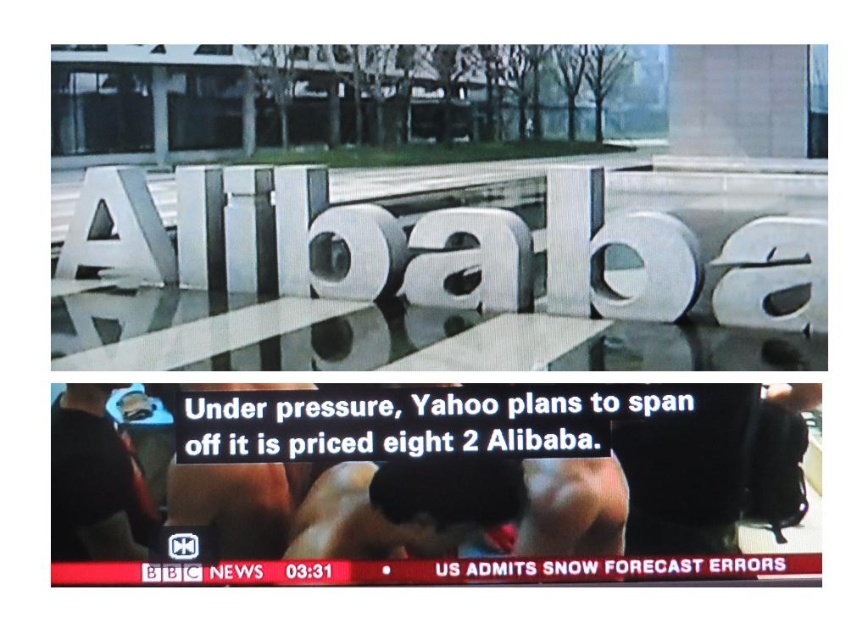
Question: Which object is the farthest from the smooth skin squat at center?

Choices:
 (A) muscle at center
 (B) skinny white skin at center
 (C) black matte shirt at lower left

Answer: (C)

Question: Does skinny white skin at center lie behind muscle at center?

Choices:
 (A) yes
 (B) no

Answer: (A)

Question: Does black matte shirt at lower left have a greater width compared to skinny white skin at center?

Choices:
 (A) yes
 (B) no

Answer: (B)

Question: Which of these objects is positioned farthest from the skinny white skin at center?

Choices:
 (A) smooth skin squat at center
 (B) black matte shirt at lower left

Answer: (A)

Question: Does black matte shirt at lower left lie in front of skinny white skin at center?

Choices:
 (A) no
 (B) yes

Answer: (B)

Question: Which object is positioned closest to the smooth skin squat at center?

Choices:
 (A) muscle at center
 (B) skinny white skin at center

Answer: (A)